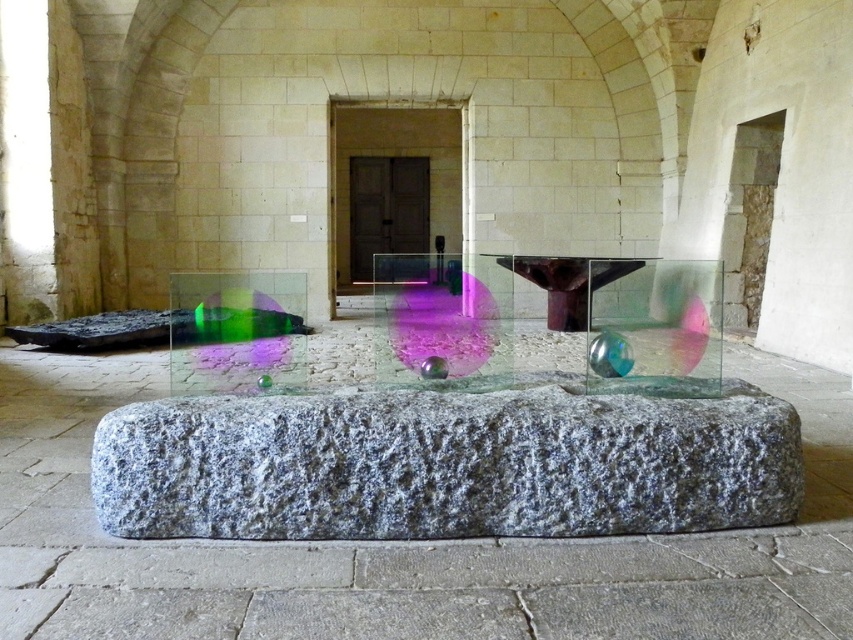
You are an architect designing a new exhibit and need to place a sculpture exactly at coordinates point 0.727, 0.523. Is the granite stone at center currently occupying that space?

The granite stone at center is located at point (445, 465), so yes, it is occupying that space and would need to be moved if placing the sculpture there.

You are standing in the historical interior and want to take a photo of the modern art installation. There are two points of interest marked on the glass box containing the spheres. Which point, point (x=547, y=385) or point (x=480, y=301), is closer to you when you take the photo?

Point (x=547, y=385) is closer to the camera than point (x=480, y=301), so it is closer to you when you take the photo.